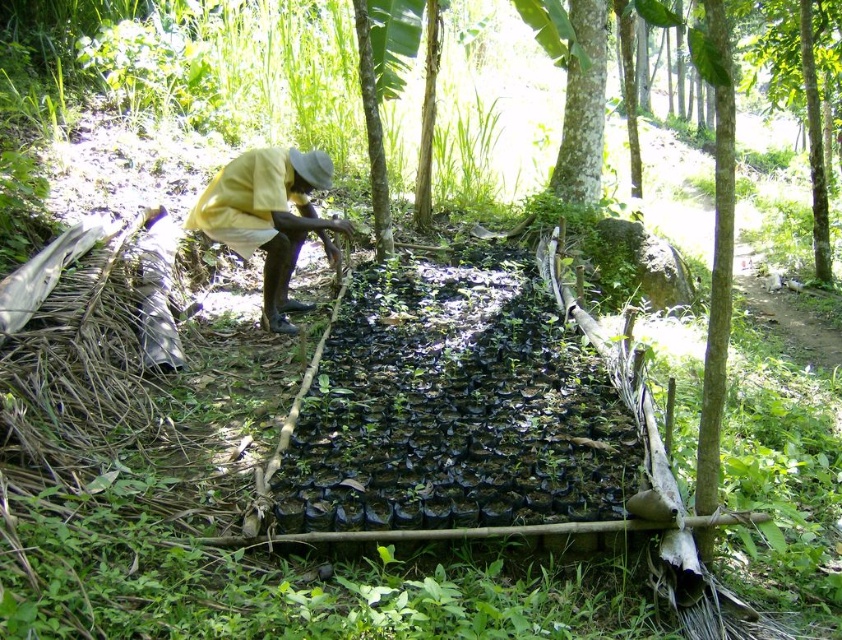
Question: Can you confirm if yellow fabric at center is positioned to the left of green rough bark tree at upper center?

Choices:
 (A) no
 (B) yes

Answer: (B)

Question: Which point is closer to the camera?

Choices:
 (A) green rough bark tree at upper center
 (B) yellow fabric at center

Answer: (B)

Question: Which of the following is the closest to the observer?

Choices:
 (A) (593, 26)
 (B) (297, 177)

Answer: (B)

Question: Does yellow fabric at center appear under green rough bark tree at upper center?

Choices:
 (A) no
 (B) yes

Answer: (B)

Question: Is yellow fabric at center wider than green rough bark tree at upper center?

Choices:
 (A) yes
 (B) no

Answer: (A)

Question: Which of the following is the farthest from the observer?

Choices:
 (A) (584, 49)
 (B) (312, 150)

Answer: (A)